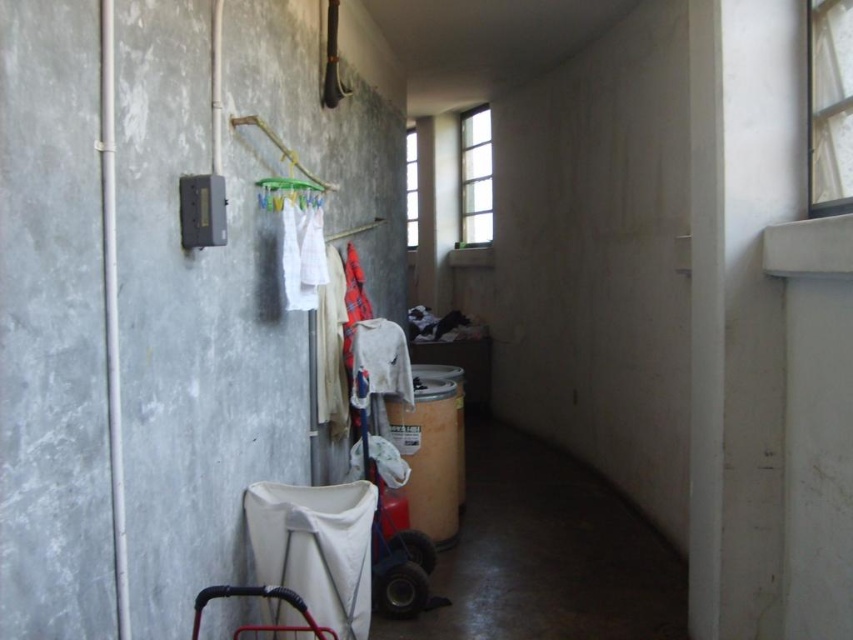
Does white sheer curtain at upper right appear over transparent glass window at upper center?

No.

Is white sheer curtain at upper right closer to the viewer compared to transparent glass window at upper center?

Yes, it is.

Who is more forward, (837, 173) or (405, 198)?

Point (837, 173) is more forward.

Where is `white sheer curtain at upper right`? white sheer curtain at upper right is located at coordinates (828, 106).

Is white sheer curtain at upper right smaller than white fabric at center?

Yes, white sheer curtain at upper right is smaller than white fabric at center.

Is white sheer curtain at upper right to the left of white fabric at center from the viewer's perspective?

No, white sheer curtain at upper right is not to the left of white fabric at center.

Find the location of `white sheer curtain at upper right`. white sheer curtain at upper right is located at coordinates (828, 106).

I want to click on white sheer curtain at upper right, so click(828, 106).

Which is more to the left, clear glass window at upper center or metallic baby carriage at lower left?

metallic baby carriage at lower left

Is clear glass window at upper center shorter than metallic baby carriage at lower left?

In fact, clear glass window at upper center may be taller than metallic baby carriage at lower left.

Does point (477, 196) come in front of point (257, 636)?

No, it is behind (257, 636).

Locate an element on the screen. This screenshot has height=640, width=853. clear glass window at upper center is located at coordinates click(474, 177).